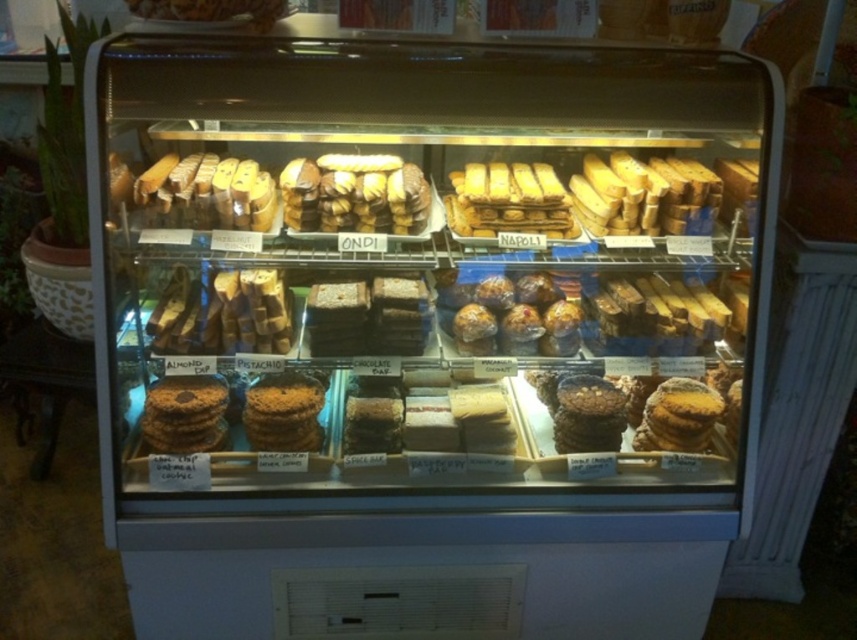
You are a customer standing in front of the bakery display case. You want to reach the brown matte cookies at center. If your arm can extend 0.5 meters, can you grab them?

The brown matte cookies at center and viewer are 1.69 meters apart from each other. Your arm can only extend 0.5 meters, so you cannot reach the brown matte cookies at center.

You are a customer at the bakery and want to choose between the brown matte cookies at center and the brown crumbly cookie at center. Which one is closer to you?

The brown matte cookies at center is closer to you than the brown crumbly cookie at center.